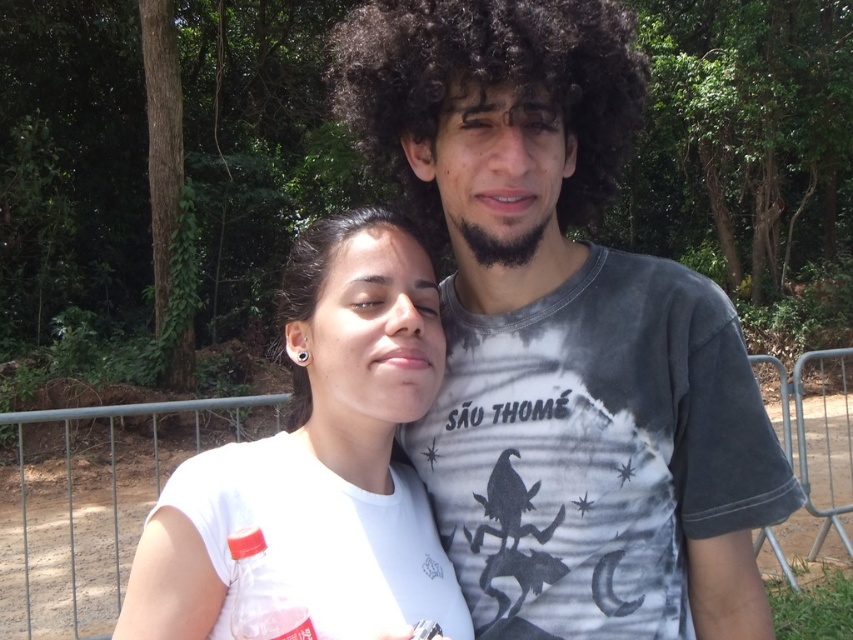
You are a photographer trying to capture a photo of the two people in the scene. The metallic gray fence at center and the black matte afro at center are both in the background. Which object is closer to the camera?

The black matte afro at center is closer to the camera than the metallic gray fence at center because the fence is further away from the viewer.